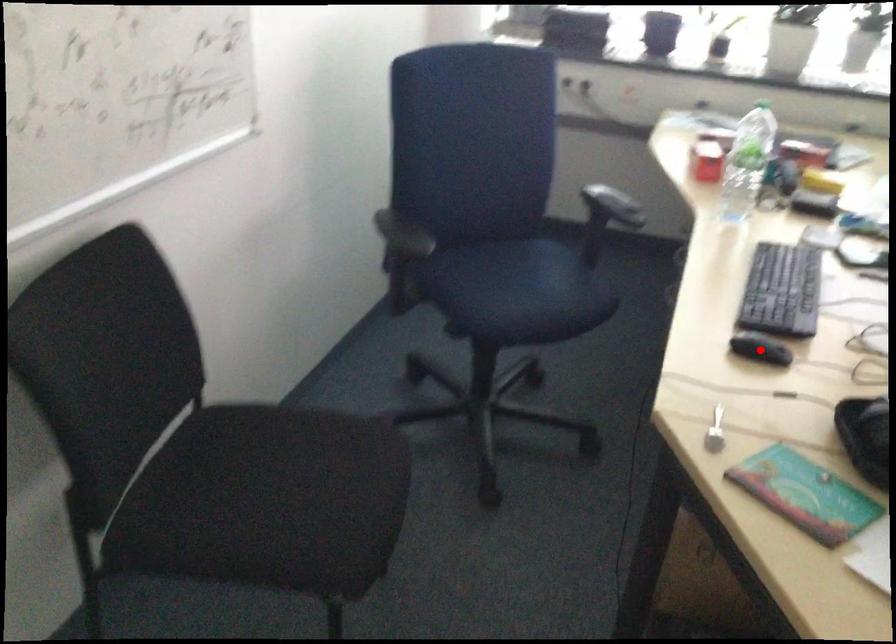
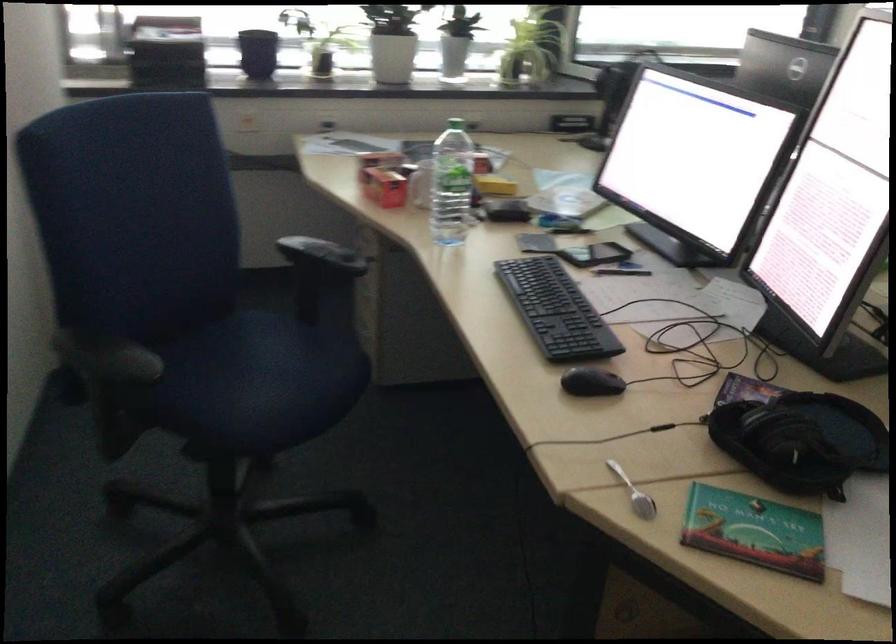
Locate, in the second image, the point that corresponds to the highlighted location in the first image.

(590, 382)